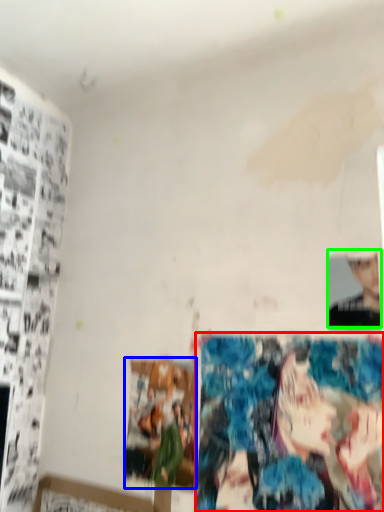
Question: Which object is the closest to the reflection (highlighted by a red box)? Choose among these: print (highlighted by a blue box) or person (highlighted by a green box).

Choices:
 (A) print
 (B) person

Answer: (A)